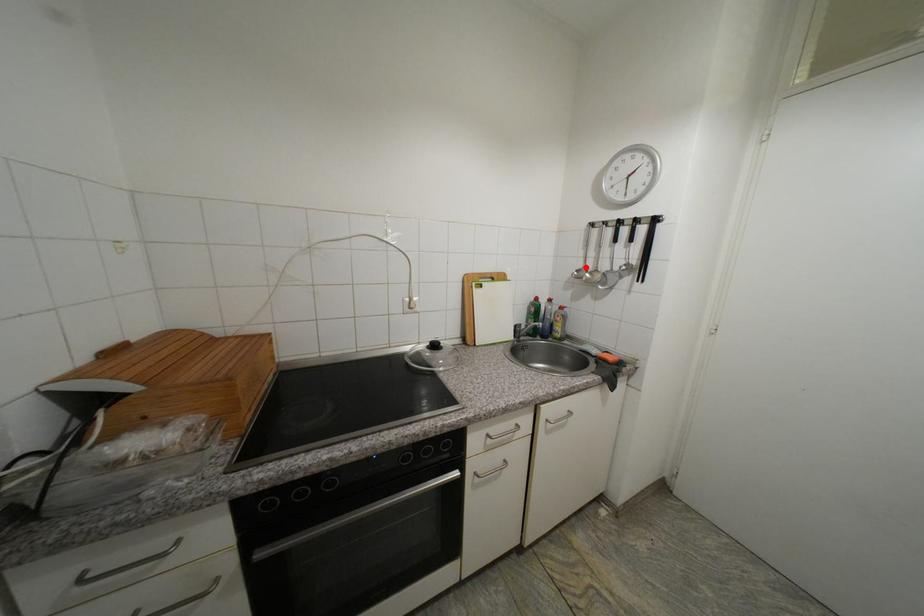
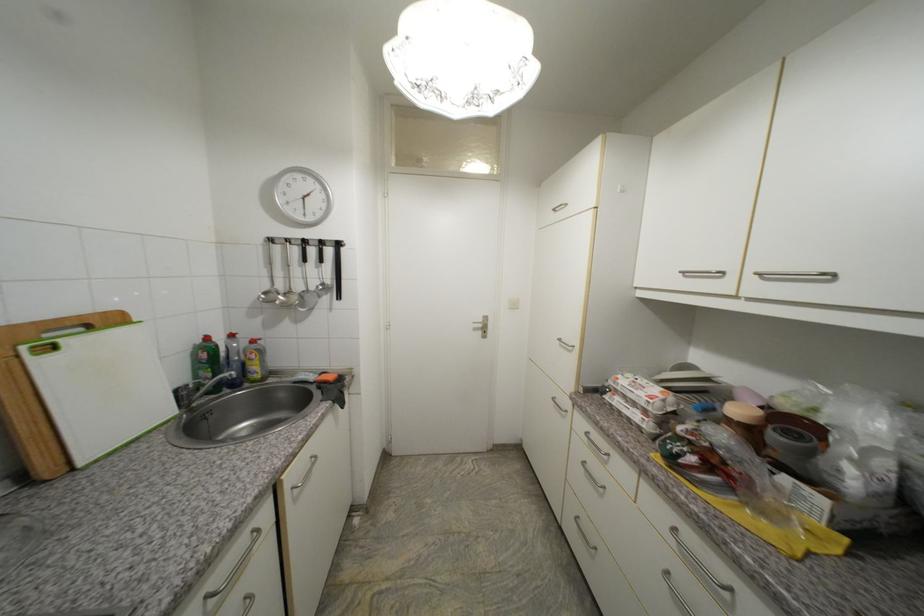
The point at the highlighted location is marked in the first image. Where is the corresponding point in the second image?

(273, 288)